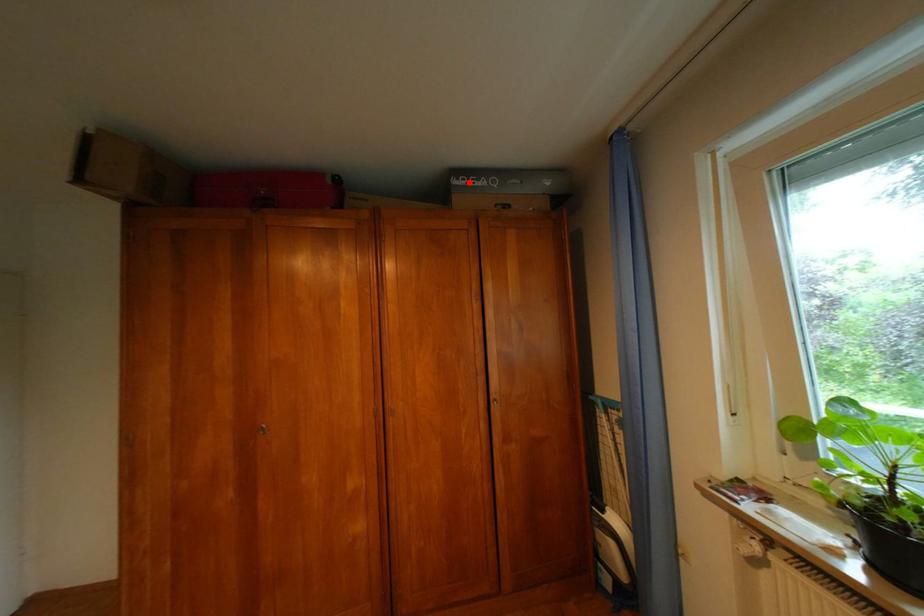
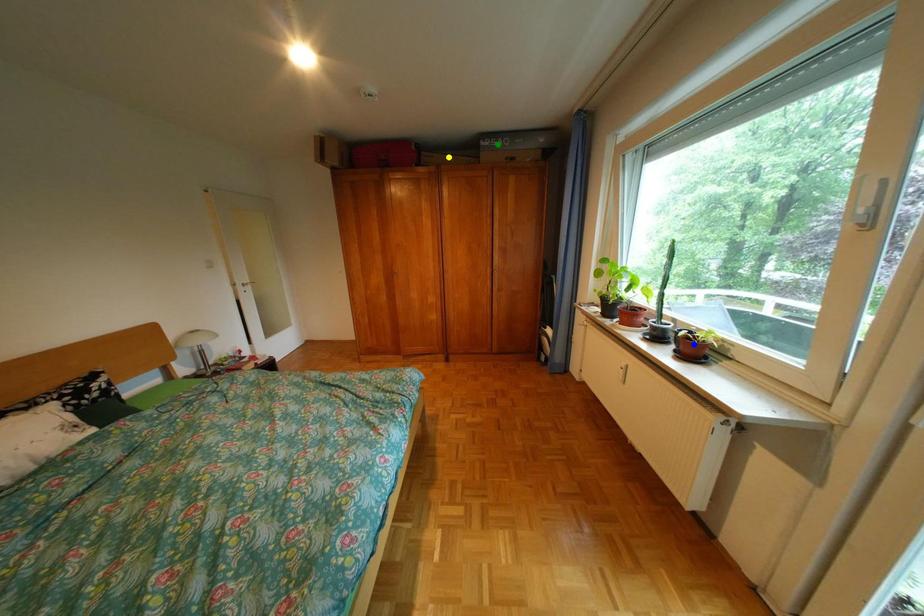
Question: I am providing you with two images of the same scene from different viewpoints. A red point is marked on the first image. You are given multiple points on the second image. Which spot in image 2 lines up with the point in image 1?

Choices:
 (A) blue point
 (B) yellow point
 (C) green point

Answer: (C)